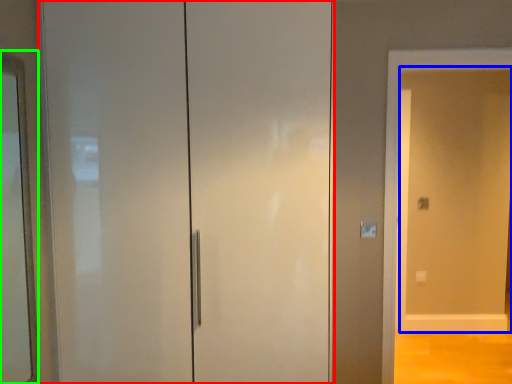
Question: Which object is positioned closest to door (highlighted by a red box)? Select from screen door (highlighted by a blue box) and mirror (highlighted by a green box).

Choices:
 (A) screen door
 (B) mirror

Answer: (B)